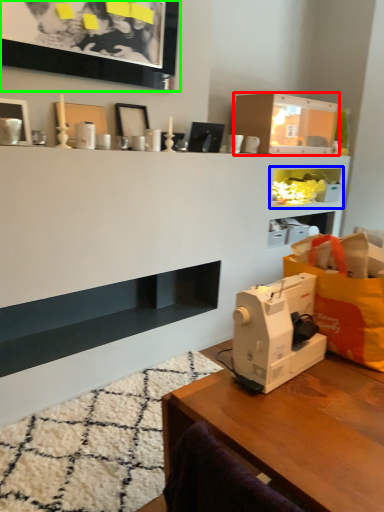
Question: Which is farther away from shelf (highlighted by a red box)? cabinet (highlighted by a blue box) or picture frame (highlighted by a green box)?

Choices:
 (A) cabinet
 (B) picture frame

Answer: (B)